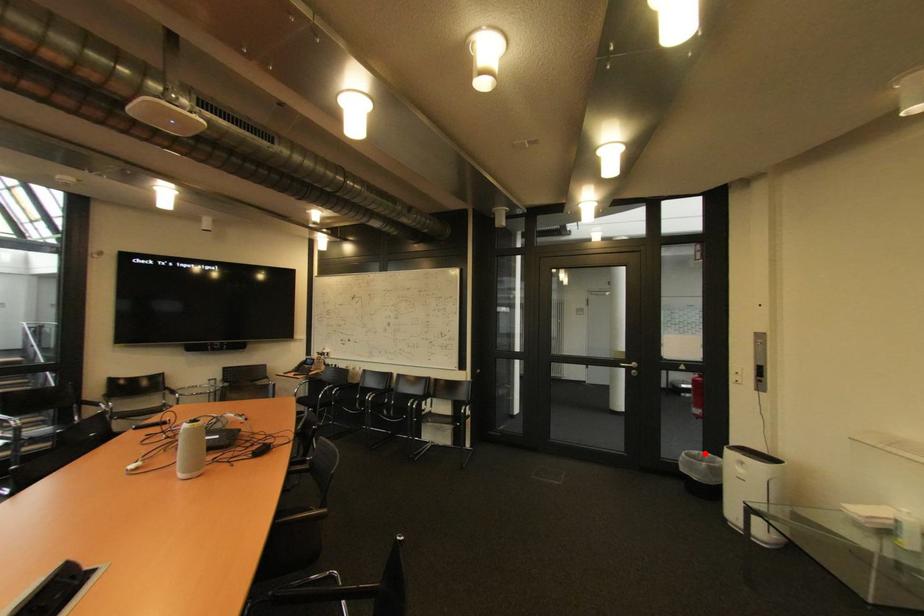
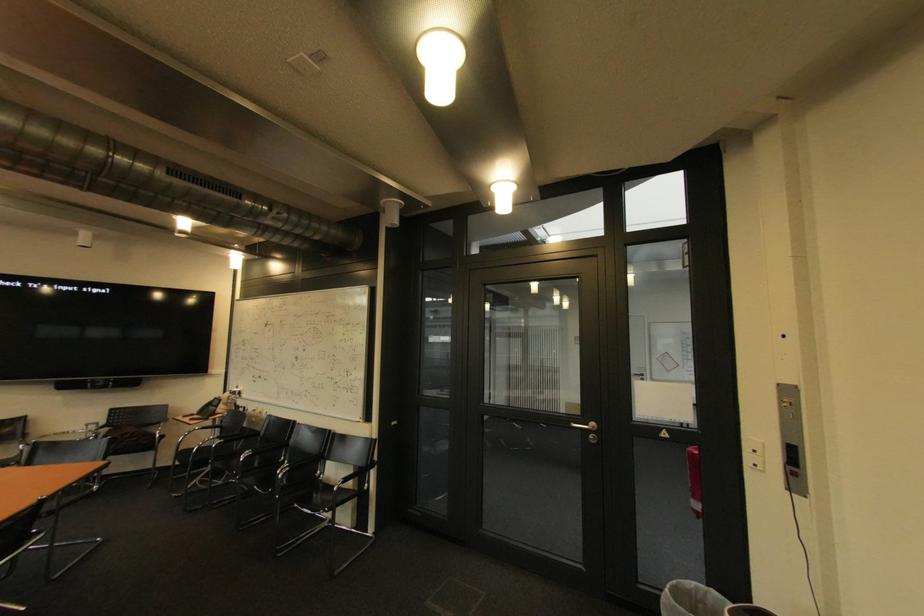
Where in the second image is the point corresponding to the highlighted location from the first image?

(701, 585)